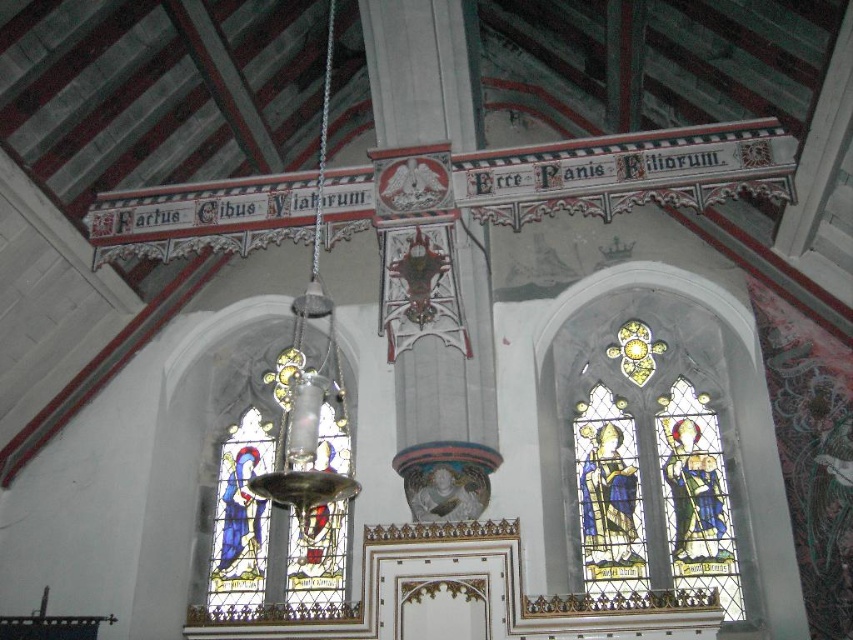
Question: Among these objects, which one is nearest to the camera?

Choices:
 (A) stained glass window at center
 (B) stained glass window at right

Answer: (A)

Question: Does stained glass window at right have a smaller size compared to stained glass window at center?

Choices:
 (A) yes
 (B) no

Answer: (A)

Question: Does stained glass window at right have a larger size compared to stained glass window at center?

Choices:
 (A) no
 (B) yes

Answer: (A)

Question: Is stained glass window at right below stained glass window at center?

Choices:
 (A) no
 (B) yes

Answer: (A)

Question: Which point appears closest to the camera in this image?

Choices:
 (A) (653, 384)
 (B) (305, 579)

Answer: (B)